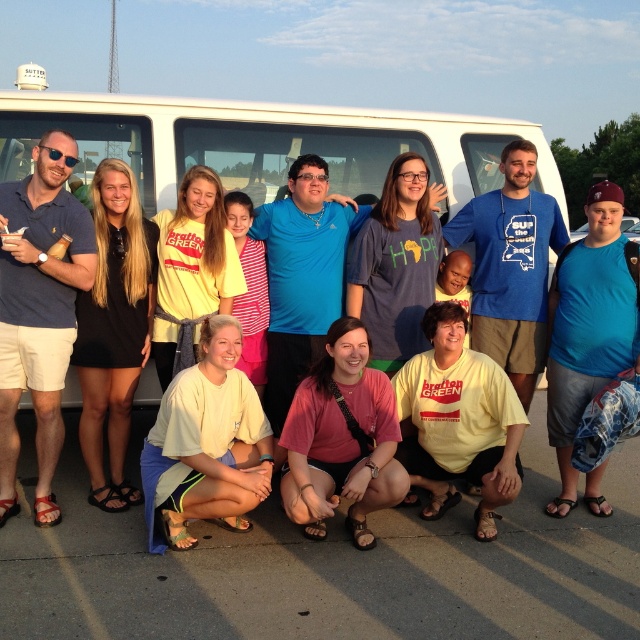
Who is lower down, black dress at left or blue t-shirt at center?

blue t-shirt at center is below.

Between black dress at left and blue t-shirt at center, which one is positioned higher?

black dress at left

The width and height of the screenshot is (640, 640). I want to click on black dress at left, so click(x=113, y=328).

Who is more forward, [232,348] or [138,205]?

Point [232,348] is more forward.

Can you confirm if yellow cotton shirt at lower center is shorter than black dress at left?

Indeed, yellow cotton shirt at lower center has a lesser height compared to black dress at left.

Does point (200, 374) come in front of point (112, 474)?

Yes, it is.

The image size is (640, 640). In order to click on yellow cotton shirt at lower center in this screenshot , I will do `click(205, 444)`.

Between white matte van at upper center and pink fabric shirt at lower center, which one has less height?

Standing shorter between the two is white matte van at upper center.

Looking at this image, does white matte van at upper center have a smaller size compared to pink fabric shirt at lower center?

No.

Is point (454, 202) more distant than point (337, 416)?

That is True.

You are a GUI agent. You are given a task and a screenshot of the screen. Output one action in this format:
    pyautogui.click(x=<x>, y=<y>)
    Task: Click on the white matte van at upper center
    This screenshot has height=640, width=640.
    Given the screenshot: What is the action you would take?
    pyautogui.click(x=266, y=141)